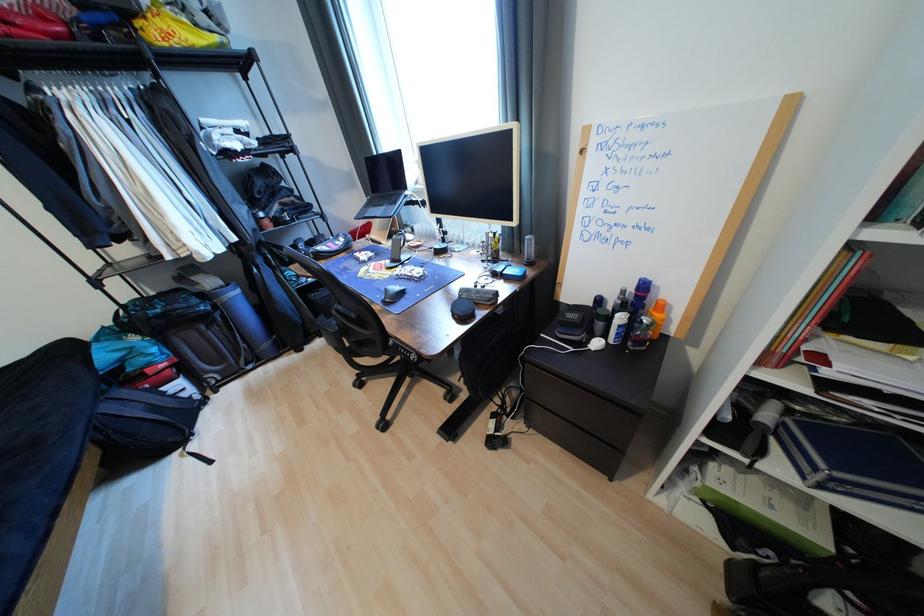
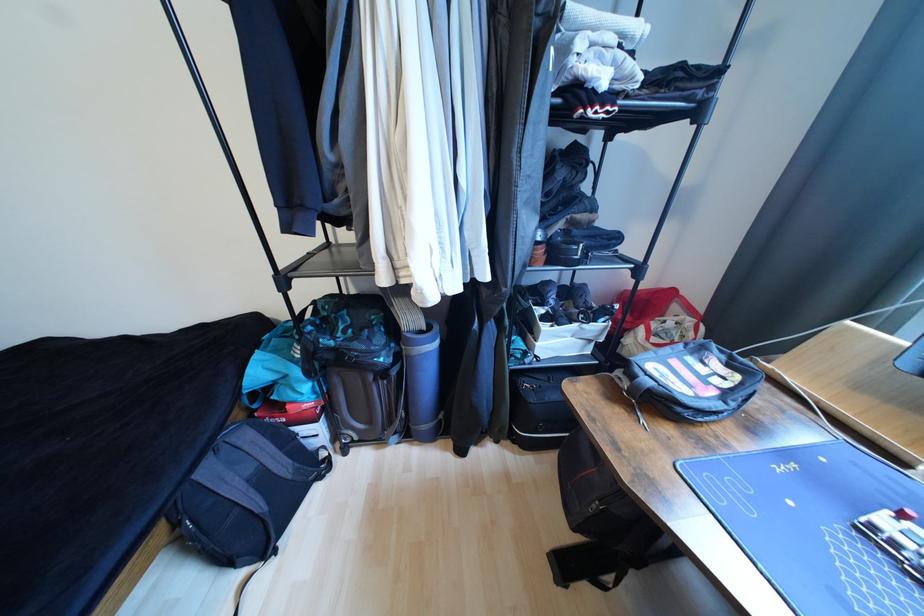
The point at (116,408) is marked in the first image. Where is the corresponding point in the second image?

(215, 472)